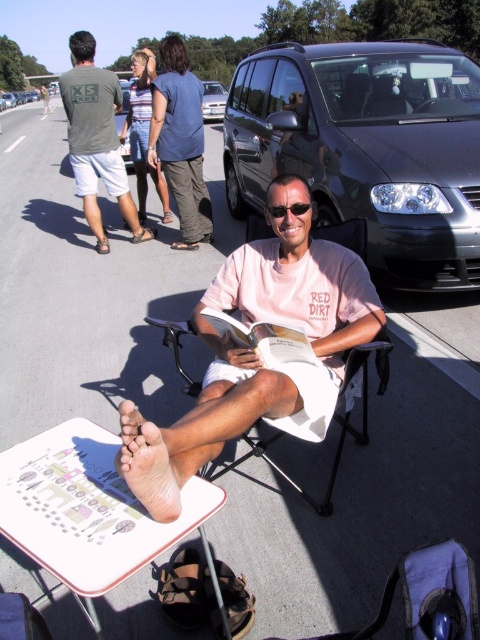
You are a pedestrian walking towards the dark gray metallic van at center and the sunglasses at center. Which object will you encounter first?

You will encounter the sunglasses at center first because they are closer to you than the dark gray metallic van at center, which is further away.